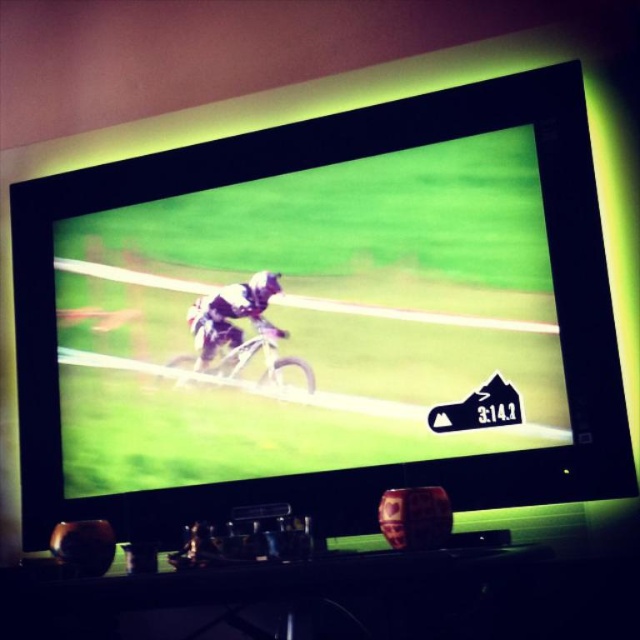
Does matte white bicycle at center appear on the left side of white matte cyclist at center?

No, matte white bicycle at center is not to the left of white matte cyclist at center.

Based on the photo, is matte white bicycle at center to the right of white matte cyclist at center from the viewer's perspective?

Yes, matte white bicycle at center is to the right of white matte cyclist at center.

Who is more forward, (314, 324) or (193, 340)?

Positioned in front is point (314, 324).

This screenshot has height=640, width=640. I want to click on matte white bicycle at center, so click(314, 321).

Is white matte cyclist at center smaller than metallic silver dirt bike at center?

Correct, white matte cyclist at center occupies less space than metallic silver dirt bike at center.

Can you confirm if white matte cyclist at center is positioned to the left of metallic silver dirt bike at center?

Correct, you'll find white matte cyclist at center to the left of metallic silver dirt bike at center.

Between point (268, 285) and point (307, 368), which one is positioned in front?

Point (307, 368) is in front.

Identify the location of white matte cyclist at center. (230, 314).

Which is more to the left, matte white bicycle at center or metallic silver dirt bike at center?

metallic silver dirt bike at center

Locate an element on the screen. matte white bicycle at center is located at coordinates (314, 321).

Identify the location of matte white bicycle at center. This screenshot has height=640, width=640. (314, 321).